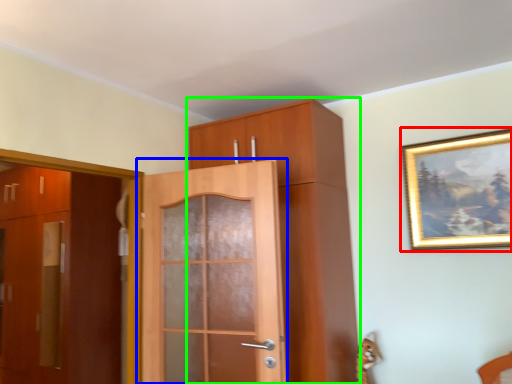
Question: Which is nearer to the picture frame (highlighted by a red box)? door (highlighted by a blue box) or cabinetry (highlighted by a green box).

Choices:
 (A) door
 (B) cabinetry

Answer: (B)